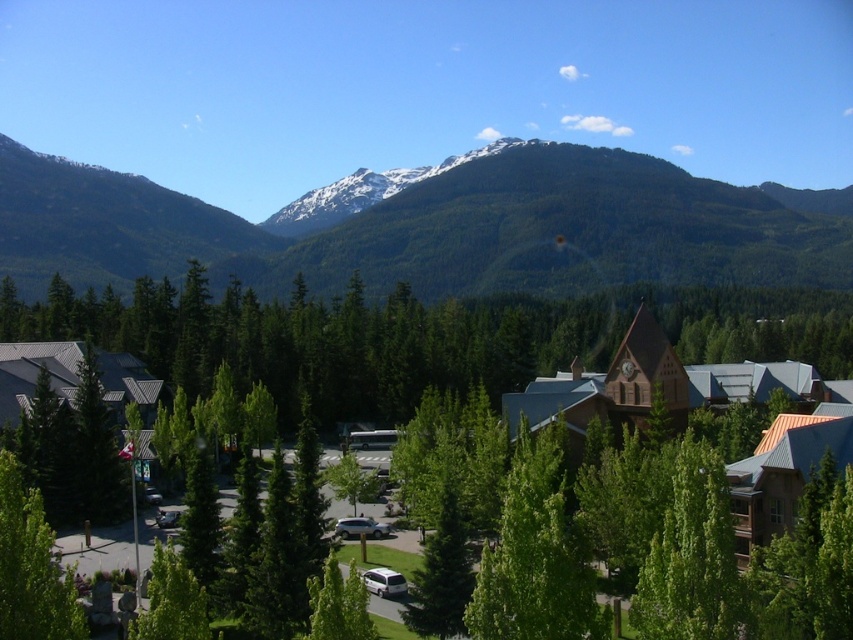
Question: Which object is the closest to the green matte tree at lower left?

Choices:
 (A) green forested mountain range at upper center
 (B) green matte tree at center
 (C) green leafy tree at lower left

Answer: (C)

Question: Based on their relative distances, which object is farther from the green matte tree at lower left?

Choices:
 (A) green forested mountain range at upper center
 (B) green matte tree at center

Answer: (A)

Question: Is green forested mountain range at upper center bigger than green matte tree at lower left?

Choices:
 (A) no
 (B) yes

Answer: (B)

Question: Can you confirm if green forested mountain range at upper center is positioned below green matte tree at center?

Choices:
 (A) yes
 (B) no

Answer: (B)

Question: Which is farther from the green leafy tree at lower left?

Choices:
 (A) green forested mountain range at upper center
 (B) green matte tree at lower left
 (C) green matte tree at center

Answer: (A)

Question: Does green forested mountain range at upper center appear on the right side of green leafy tree at lower left?

Choices:
 (A) no
 (B) yes

Answer: (A)